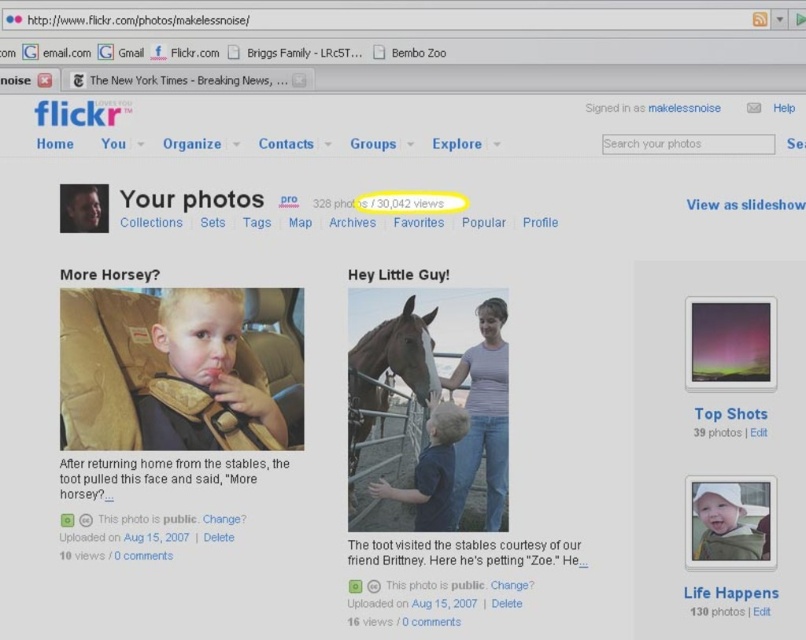
Which is more to the left, blonde hair baby at center or purple aurora at upper right?

Positioned to the left is blonde hair baby at center.

Does point (256, 417) come behind point (705, 317)?

Yes, it is.

Who is more distant from viewer, (172, 445) or (767, 355)?

Positioned behind is point (172, 445).

This screenshot has height=640, width=806. I want to click on blonde hair baby at center, so click(202, 376).

Is brown glossy horse at center bigger than white plastic sign at upper center?

Yes.

Between brown glossy horse at center and white plastic sign at upper center, which one has more height?

brown glossy horse at center is taller.

The height and width of the screenshot is (640, 806). Describe the element at coordinates (397, 349) in the screenshot. I see `brown glossy horse at center` at that location.

Identify the location of brown glossy horse at center. The image size is (806, 640). (397, 349).

Is blonde hair baby at center further to camera compared to blue matte shirt at center?

No, blonde hair baby at center is closer to the viewer.

Does point (204, 385) come farther from viewer compared to point (389, 488)?

No, (204, 385) is in front of (389, 488).

This screenshot has width=806, height=640. What do you see at coordinates (202, 376) in the screenshot? I see `blonde hair baby at center` at bounding box center [202, 376].

Locate an element on the screen. The image size is (806, 640). blonde hair baby at center is located at coordinates (202, 376).